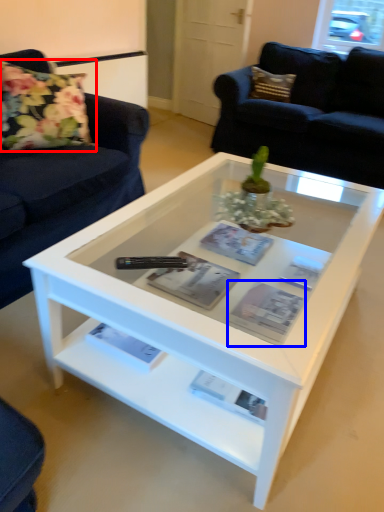
Question: Which object is closer to the camera taking this photo, flower (highlighted by a red box) or magazine (highlighted by a blue box)?

Choices:
 (A) flower
 (B) magazine

Answer: (B)